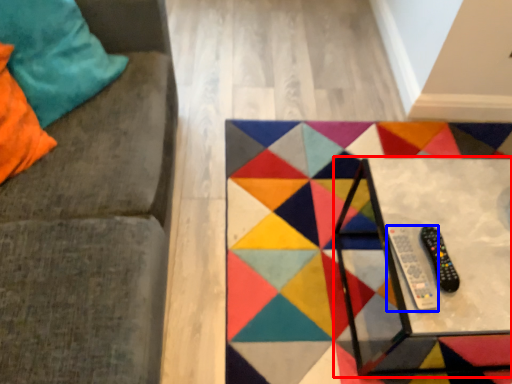
Question: Which of the following is the farthest to the observer, table (highlighted by a red box) or remote (highlighted by a blue box)?

Choices:
 (A) table
 (B) remote

Answer: (B)